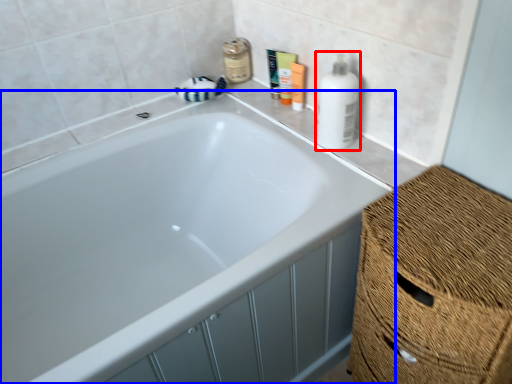
Question: Which point is closer to the camera, cleaning product (highlighted by a red box) or bathtub (highlighted by a blue box)?

Choices:
 (A) cleaning product
 (B) bathtub

Answer: (B)